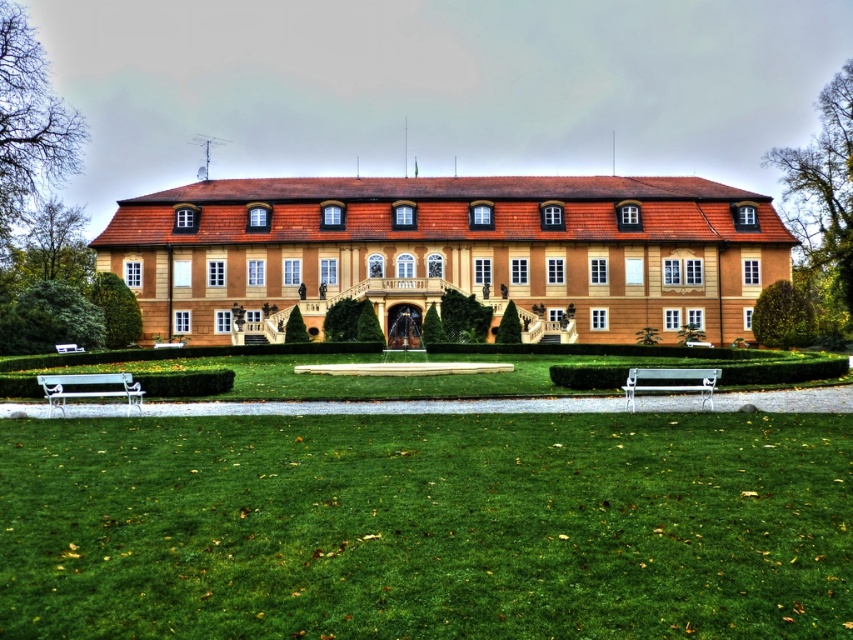
Question: Which point is farther to the camera?

Choices:
 (A) white painted wood bench at lower left
 (B) green grass at lower center

Answer: (A)

Question: Where is white metallic bench at lower center located in relation to white painted wood bench at lower left in the image?

Choices:
 (A) right
 (B) left

Answer: (A)

Question: Does white metallic bench at lower center have a lesser width compared to white painted wood bench at lower left?

Choices:
 (A) no
 (B) yes

Answer: (A)

Question: Which is nearer to the white painted wood bench at lower left?

Choices:
 (A) white metallic bench at lower center
 (B) green grass at lower center

Answer: (B)

Question: Among these objects, which one is farthest from the camera?

Choices:
 (A) white painted wood bench at lower left
 (B) white metallic bench at lower center
 (C) green grass at lower center

Answer: (B)

Question: Considering the relative positions of white metallic bench at lower center and white painted wood bench at lower left in the image provided, where is white metallic bench at lower center located with respect to white painted wood bench at lower left?

Choices:
 (A) above
 (B) below

Answer: (A)